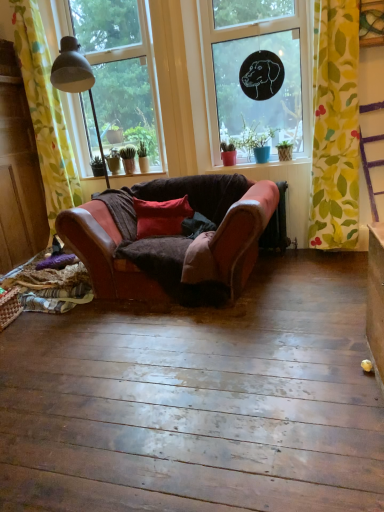
Question: Is green fabric at lower left not near transparent glass window at upper left, which ranks as the 2th window in right-to-left order?

Choices:
 (A) no
 (B) yes

Answer: (A)

Question: Does green fabric at lower left have a larger size compared to transparent glass window at upper left, the first window positioned from the left?

Choices:
 (A) no
 (B) yes

Answer: (A)

Question: From the image's perspective, is green fabric at lower left below transparent glass window at upper left, which ranks as the 2th window in right-to-left order?

Choices:
 (A) yes
 (B) no

Answer: (A)

Question: From a real-world perspective, is green fabric at lower left positioned over transparent glass window at upper left, the first window positioned from the left, based on gravity?

Choices:
 (A) no
 (B) yes

Answer: (A)

Question: Does green fabric at lower left appear on the right side of transparent glass window at upper left, the first window positioned from the left?

Choices:
 (A) no
 (B) yes

Answer: (B)

Question: From the image's perspective, is green fabric at lower left positioned above or below yellow floral fabric at right, which appears as the first curtain when viewed from the right?

Choices:
 (A) above
 (B) below

Answer: (B)

Question: From a real-world perspective, is green fabric at lower left above or below yellow floral fabric at right, which appears as the first curtain when viewed from the right?

Choices:
 (A) above
 (B) below

Answer: (B)

Question: Is green fabric at lower left inside the boundaries of yellow floral fabric at right, positioned as the second curtain in left-to-right order, or outside?

Choices:
 (A) inside
 (B) outside

Answer: (B)

Question: In terms of height, does green fabric at lower left look taller or shorter compared to yellow floral fabric at right, which appears as the first curtain when viewed from the right?

Choices:
 (A) tall
 (B) short

Answer: (B)

Question: Would you say transparent glass window at upper left, the first window positioned from the left, is to the left or to the right of green fabric at lower left in the picture?

Choices:
 (A) left
 (B) right

Answer: (A)

Question: Is transparent glass window at upper left, which ranks as the 2th window in right-to-left order, wider or thinner than green fabric at lower left?

Choices:
 (A) thin
 (B) wide

Answer: (A)

Question: Looking at the image, does transparent glass window at upper left, which ranks as the 2th window in right-to-left order, seem bigger or smaller compared to green fabric at lower left?

Choices:
 (A) big
 (B) small

Answer: (A)

Question: Relative to green fabric at lower left, is transparent glass window at upper left, the first window positioned from the left, in front or behind?

Choices:
 (A) behind
 (B) front

Answer: (B)

Question: Looking at the image, does yellow floral fabric at left, which is the 2th curtain in right-to-left order, seem bigger or smaller compared to yellow floral fabric at right, which appears as the first curtain when viewed from the right?

Choices:
 (A) big
 (B) small

Answer: (A)

Question: From a real-world perspective, is yellow floral fabric at left, which is the 2th curtain in right-to-left order, above or below yellow floral fabric at right, which appears as the first curtain when viewed from the right?

Choices:
 (A) above
 (B) below

Answer: (A)